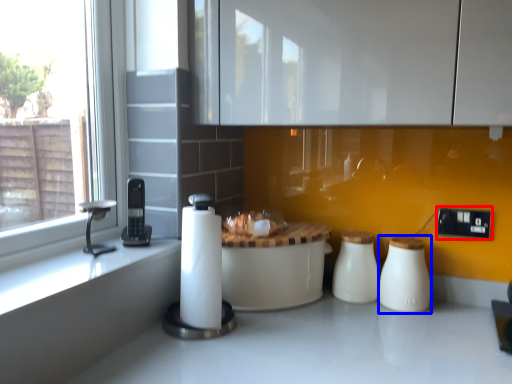
Question: Which object appears farthest to the camera in this image, electric outlet (highlighted by a red box) or salt shaker (highlighted by a blue box)?

Choices:
 (A) electric outlet
 (B) salt shaker

Answer: (A)